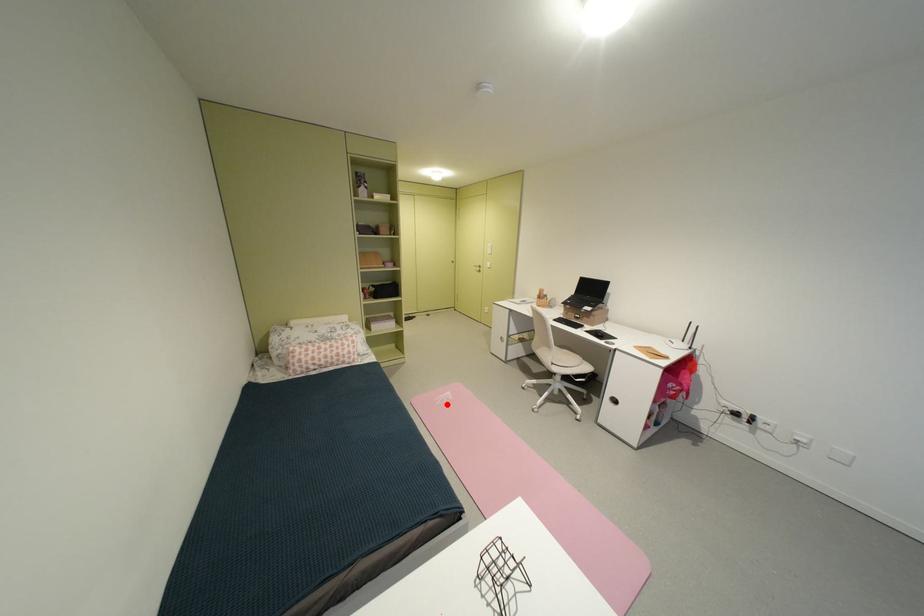
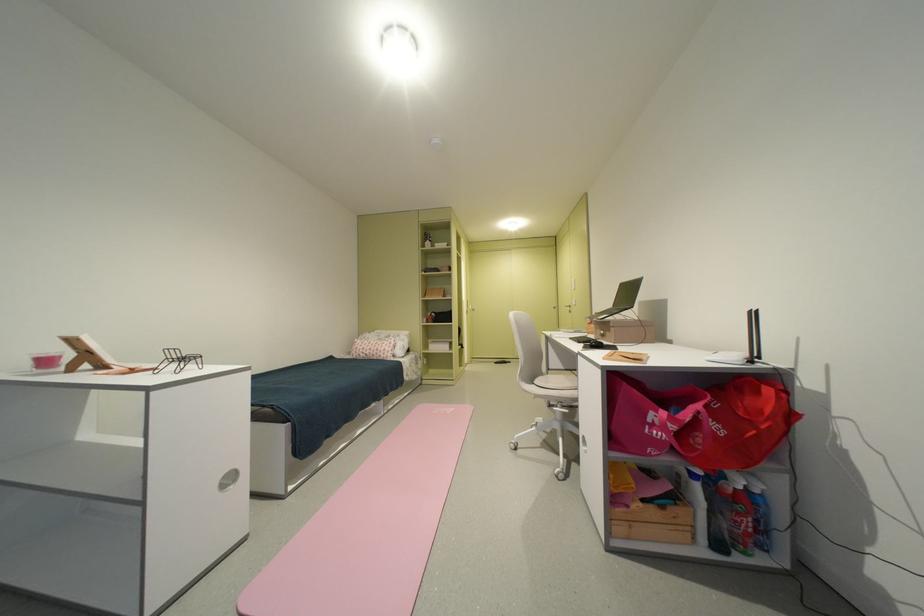
Question: I am providing you with two images of the same scene from different viewpoints. In image1, a red point is highlighted. Considering the same 3D point in image2, which of the following is correct?

Choices:
 (A) It is closer
 (B) It is farther

Answer: (B)